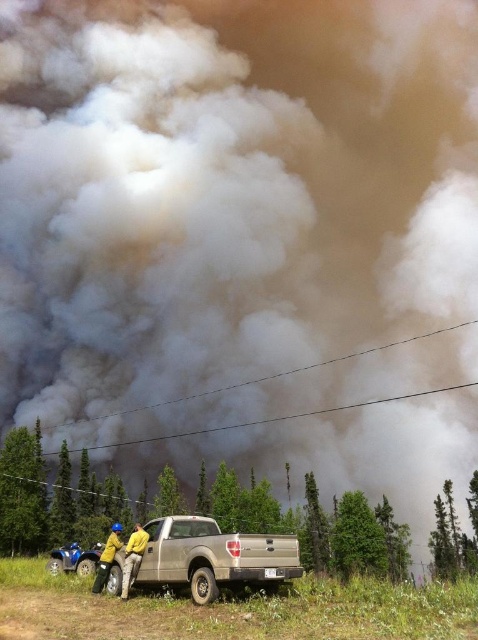
Question: Can you confirm if yellow fabric person at lower center is positioned to the left of yellow fabric jacket at lower left?

Choices:
 (A) yes
 (B) no

Answer: (B)

Question: Which point is closer to the camera?

Choices:
 (A) (134, 525)
 (B) (97, 566)

Answer: (B)

Question: Which of the following is the farthest from the observer?

Choices:
 (A) (99, 568)
 (B) (122, 566)

Answer: (A)

Question: Is yellow fabric person at lower center wider than yellow fabric jacket at lower left?

Choices:
 (A) yes
 (B) no

Answer: (B)

Question: Is yellow fabric person at lower center bigger than yellow fabric jacket at lower left?

Choices:
 (A) yes
 (B) no

Answer: (A)